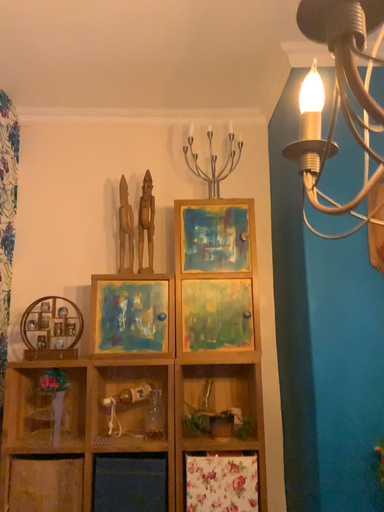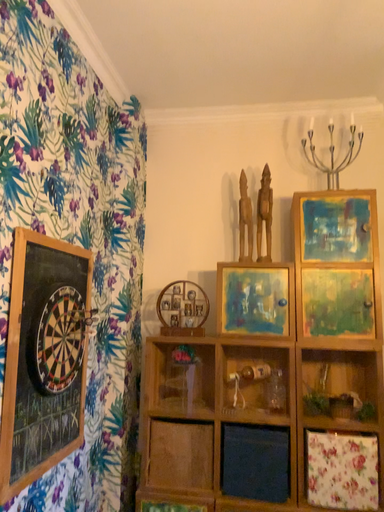
Question: Which way did the camera rotate in the video?

Choices:
 (A) rotated right
 (B) rotated left

Answer: (B)